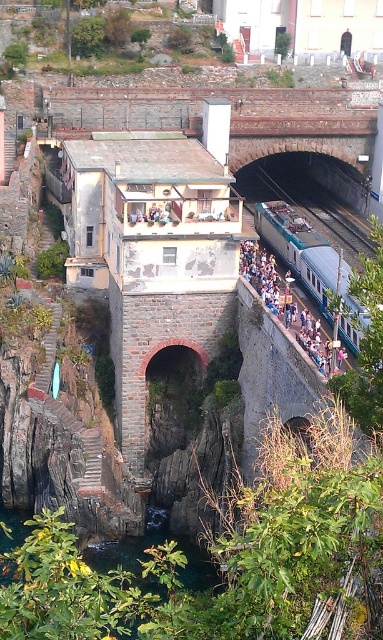
You are a photographer standing in the coastal town scene. You want to take a photo that includes both the smooth concrete train track at center and the blue fabric crowd at center. Which object should be placed closer to the camera to ensure both are in focus?

The blue fabric crowd at center is behind the smooth concrete train track at center, so to ensure both are in focus, the smooth concrete train track at center should be closer to the camera. This way, the crowd will be in the background and the track in the foreground, allowing for a greater depth of field.

You are a train engineer planning to travel along the smooth concrete train track at center. What coordinates should you aim for to ensure you are on the correct path?

The smooth concrete train track at center is located at point (x=312, y=200), so aim for those coordinates to stay on the correct path.

You are standing at the base of the stone bridge in the coastal town scene. You see two points marked on the bridge structure. The first point is at coordinates point (348, 266) and the second is at point (266, 172). If you were to walk towards the bridge from your current position, which point would you encounter first?

Point (348, 266) is in front of point (266, 172), so you would encounter point (348, 266) first as you approach the bridge.